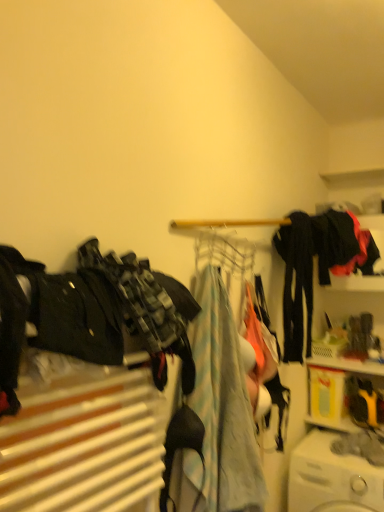
Question: Is camouflage fabric pants at left, the 1th clothing from the left, located outside black matte jacket at upper right, which is the fourth clothing from front to back?

Choices:
 (A) yes
 (B) no

Answer: (A)

Question: Can black matte jacket at upper right, which is the fourth clothing from front to back, be found inside camouflage fabric pants at left, the 1th clothing from the left?

Choices:
 (A) yes
 (B) no

Answer: (B)

Question: Can you confirm if camouflage fabric pants at left, the 1th clothing from the left, is wider than black matte jacket at upper right, acting as the first clothing starting from the right?

Choices:
 (A) yes
 (B) no

Answer: (B)

Question: Is camouflage fabric pants at left, which is counted as the fourth clothing, starting from the back, bigger than black matte jacket at upper right, which is the fourth clothing from front to back?

Choices:
 (A) no
 (B) yes

Answer: (A)

Question: Is camouflage fabric pants at left, which is counted as the fourth clothing, starting from the back, not close to black matte jacket at upper right, acting as the first clothing starting from the right?

Choices:
 (A) yes
 (B) no

Answer: (A)

Question: From a real-world perspective, is camouflage fabric pants at left, placed as the first clothing when sorted from front to back, physically above black matte jacket at upper right, acting as the first clothing starting from the right?

Choices:
 (A) yes
 (B) no

Answer: (B)

Question: Is white plastic washing machine at lower right oriented towards metallic wire clothesline at center?

Choices:
 (A) no
 (B) yes

Answer: (A)

Question: Would you say metallic wire clothesline at center is part of white plastic washing machine at lower right's contents?

Choices:
 (A) no
 (B) yes

Answer: (A)

Question: Considering the relative sizes of white plastic washing machine at lower right and metallic wire clothesline at center in the image provided, is white plastic washing machine at lower right wider than metallic wire clothesline at center?

Choices:
 (A) no
 (B) yes

Answer: (B)

Question: Is white plastic washing machine at lower right with metallic wire clothesline at center?

Choices:
 (A) yes
 (B) no

Answer: (B)

Question: Does white plastic washing machine at lower right have a greater height compared to metallic wire clothesline at center?

Choices:
 (A) no
 (B) yes

Answer: (B)

Question: Is white plastic washing machine at lower right to the left of metallic wire clothesline at center from the viewer's perspective?

Choices:
 (A) yes
 (B) no

Answer: (B)

Question: From a real-world perspective, is black matte pants at center right, which is the 2th clothing in back-to-front order, positioned under white plastic washing machine at lower right based on gravity?

Choices:
 (A) no
 (B) yes

Answer: (A)